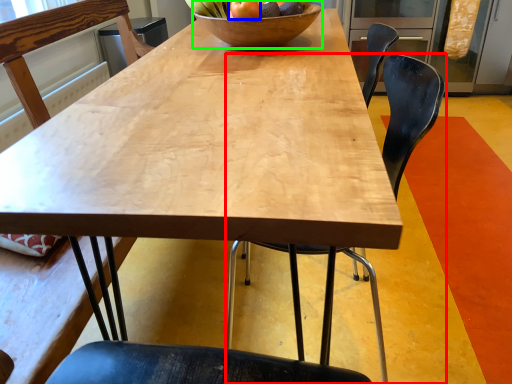
Question: Based on their relative distances, which object is farther from chair (highlighted by a red box)? Choose from apple (highlighted by a blue box) and bowl (highlighted by a green box).

Choices:
 (A) apple
 (B) bowl

Answer: (A)